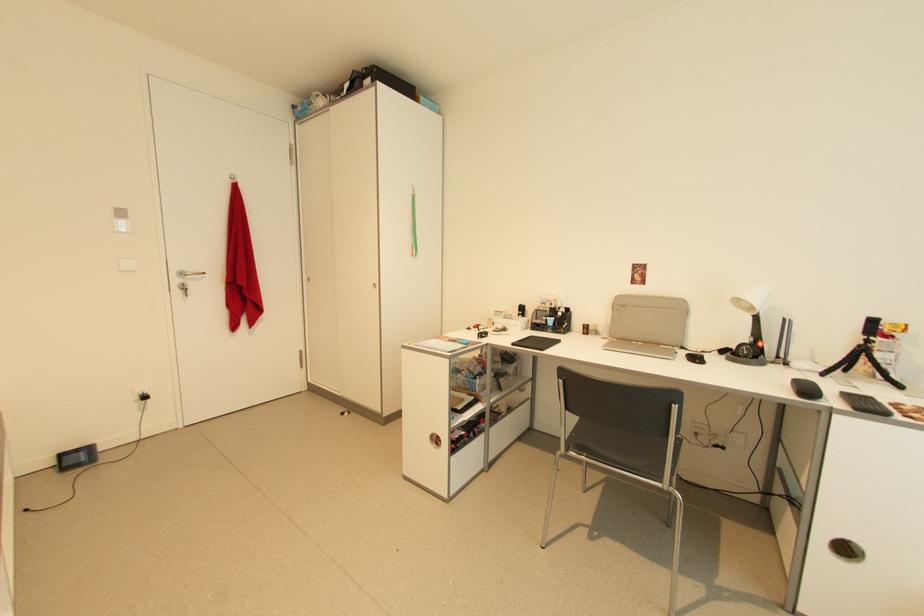
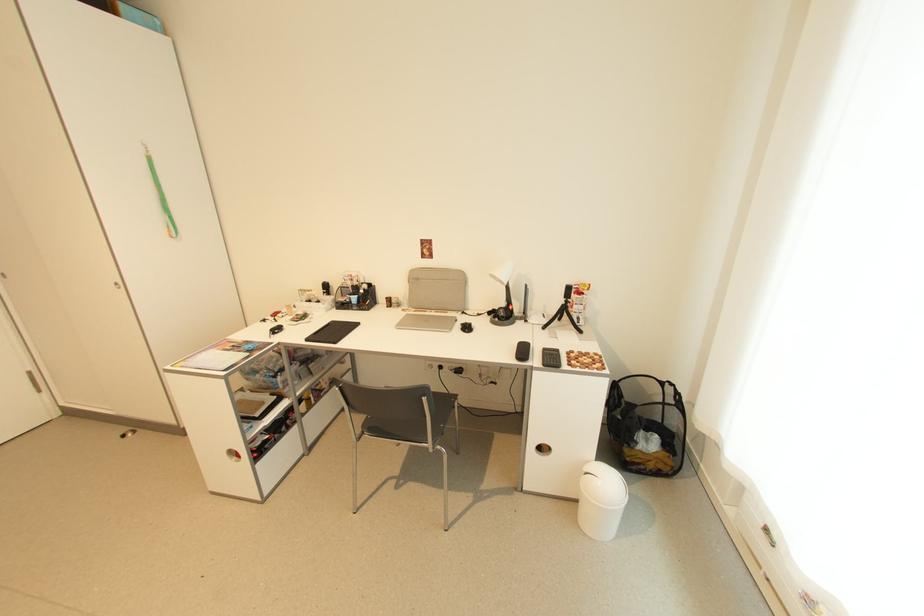
Locate, in the second image, the point that corresponds to point (436, 445) in the first image.

(237, 460)